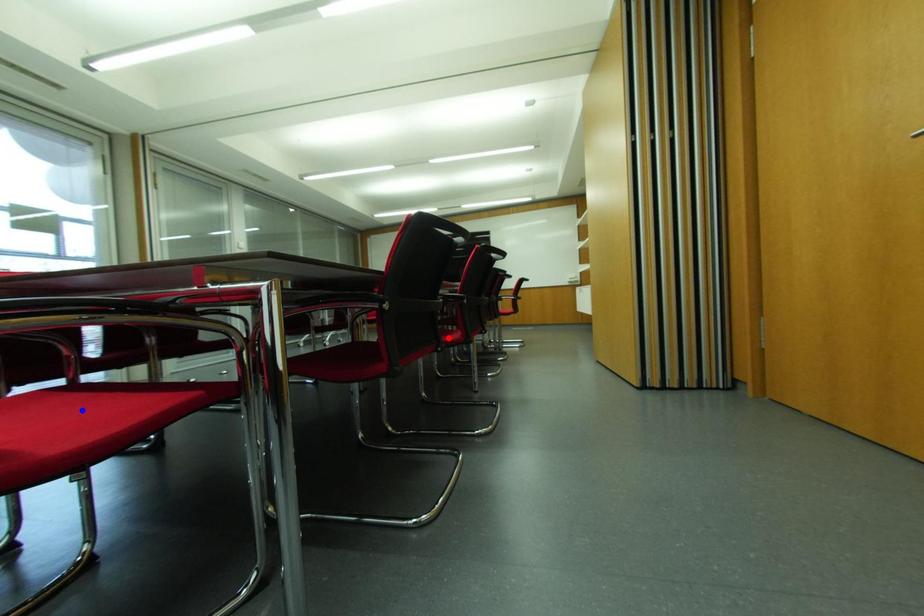
Question: Two points are marked on the image. Which point is closer to the camera?

Choices:
 (A) Blue point is closer.
 (B) Red point is closer.

Answer: (A)